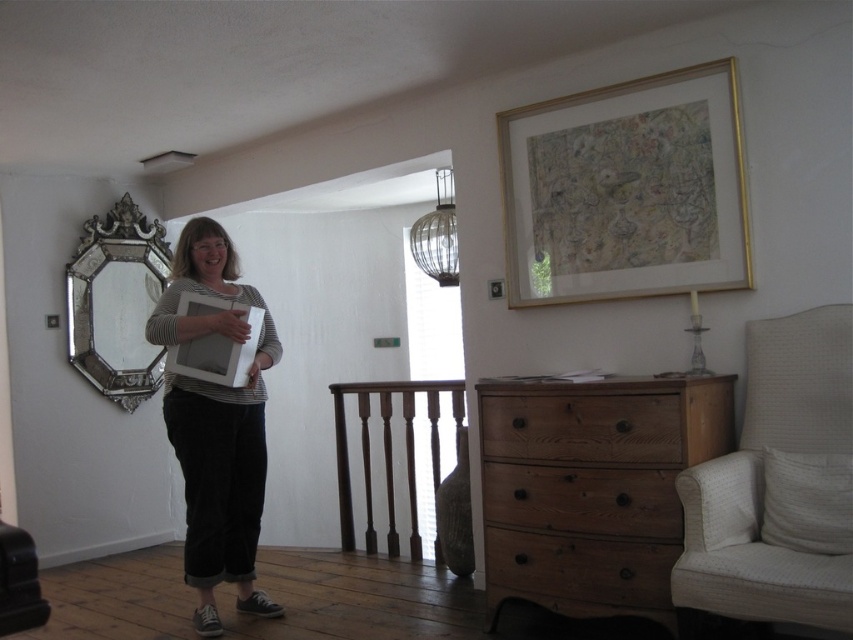
Who is more forward, (622, 186) or (132, 252)?

Point (622, 186) is in front.

I want to click on gold/golden picture frame at upper right, so click(630, 192).

Which is in front, point (599, 412) or point (248, 355)?

Point (599, 412)

Is wooden drawer at center smaller than matte white picture frame at center?

Incorrect, wooden drawer at center is not smaller in size than matte white picture frame at center.

Who is more forward, [543,413] or [186,365]?

Point [543,413]

Find the location of a particular element. The width and height of the screenshot is (853, 640). wooden drawer at center is located at coordinates (582, 428).

In the scene shown: Which is below, silver ornate mirror at left or brown wooden balustrade at center?

brown wooden balustrade at center is below.

Does silver ornate mirror at left have a lesser width compared to brown wooden balustrade at center?

Yes, silver ornate mirror at left is thinner than brown wooden balustrade at center.

Locate an element on the screen. The height and width of the screenshot is (640, 853). silver ornate mirror at left is located at coordinates (115, 301).

Find the location of a particular element. silver ornate mirror at left is located at coordinates (115, 301).